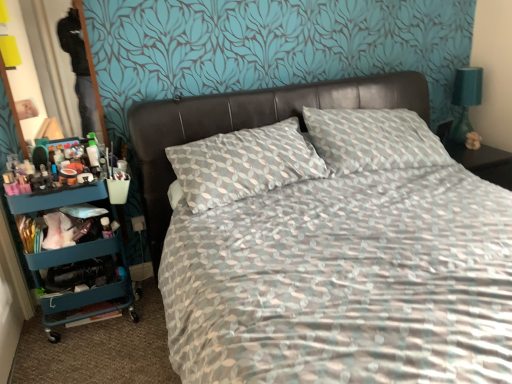
Question: From their relative heights in the image, would you say teal plastic cart at left is taller or shorter than teal fabric lampshade at right?

Choices:
 (A) tall
 (B) short

Answer: (A)

Question: Considering their positions, is teal plastic cart at left located in front of or behind teal fabric lampshade at right?

Choices:
 (A) front
 (B) behind

Answer: (A)

Question: Which object is positioned closest to the leather at center?

Choices:
 (A) teal plastic cart at left
 (B) teal fabric lampshade at right

Answer: (A)

Question: Which of these objects is positioned closest to the teal fabric lampshade at right?

Choices:
 (A) teal plastic cart at left
 (B) leather at center

Answer: (B)